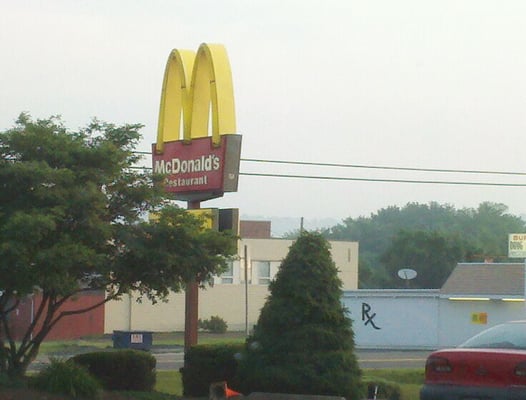
The image size is (526, 400). What are the coordinates of `window` in the screenshot? It's located at (264, 270), (230, 271).